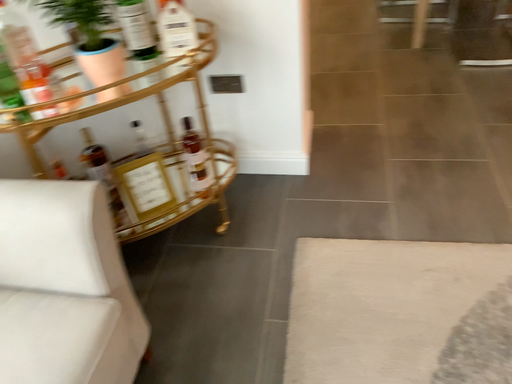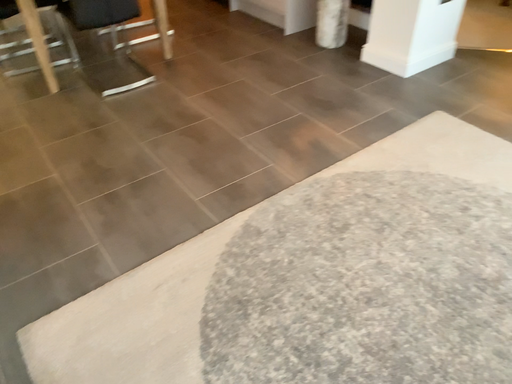
Question: Which way did the camera rotate in the video?

Choices:
 (A) rotated upward
 (B) rotated downward

Answer: (A)